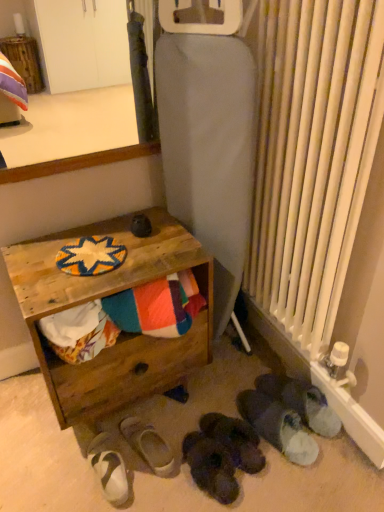
This screenshot has width=384, height=512. Find the location of `vacant space to the left of white fabric slipper at lower center, which appears as the fifth footwear when viewed from the right`. vacant space to the left of white fabric slipper at lower center, which appears as the fifth footwear when viewed from the right is located at coordinates (77, 469).